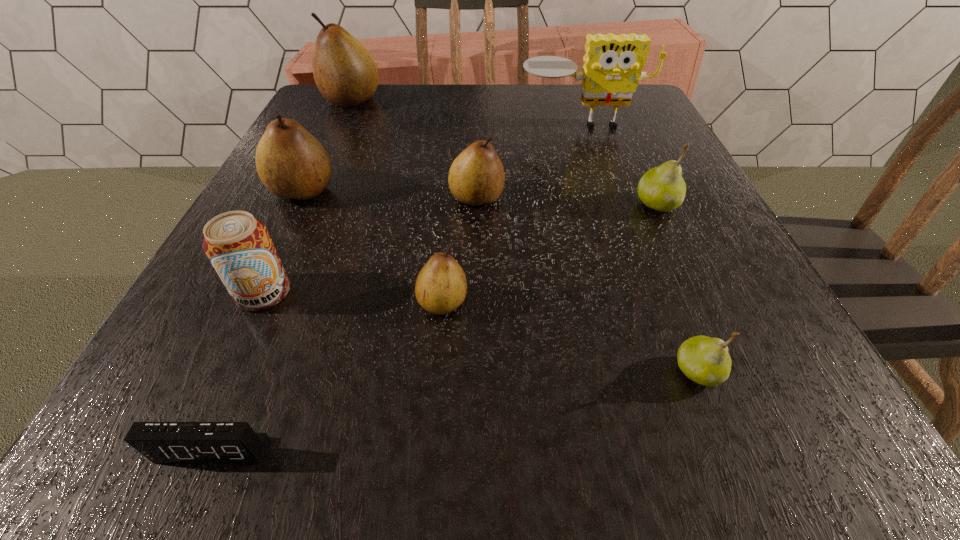
The height and width of the screenshot is (540, 960). I want to click on free space that is in between the fifth farthest pear and the nearest object, so click(327, 376).

The image size is (960, 540). What are the coordinates of `free space that is in between the fifth farthest pear and the farthest brown pear` in the screenshot? It's located at (397, 201).

Find the location of a particular element. The image size is (960, 540). empty location between the yellow sponge and the smaller green pear is located at coordinates (640, 248).

The width and height of the screenshot is (960, 540). I want to click on unoccupied area between the fifth shortest pear and the second smallest brown pear, so click(x=390, y=194).

The width and height of the screenshot is (960, 540). What are the coordinates of `vacant region between the smaller green pear and the yellow sponge` in the screenshot? It's located at (640, 248).

You are a GUI agent. You are given a task and a screenshot of the screen. Output one action in this format:
    pyautogui.click(x=<x>, y=<y>)
    Task: Click on the free space between the second smallest brown pear and the nearest brown pear
    This screenshot has width=960, height=540.
    Given the screenshot: What is the action you would take?
    pyautogui.click(x=460, y=251)

Choose which object is the sixth nearest neighbor to the beer can. Please provide its 2D coordinates. Your answer should be formatted as a tuple, i.e. [(x, y)], where the tuple contains the x and y coordinates of a point satisfying the conditions above.

[(345, 73)]

Identify which object is the fifth nearest to the farthest pear. Please provide its 2D coordinates. Your answer should be formatted as a tuple, i.e. [(x, y)], where the tuple contains the x and y coordinates of a point satisfying the conditions above.

[(441, 286)]

Choose which pear is the fifth nearest neighbor to the second smallest brown pear. Please provide its 2D coordinates. Your answer should be formatted as a tuple, i.e. [(x, y)], where the tuple contains the x and y coordinates of a point satisfying the conditions above.

[(706, 361)]

Where is `the third closest pear to the third biggest brown pear`? The width and height of the screenshot is (960, 540). the third closest pear to the third biggest brown pear is located at coordinates (662, 188).